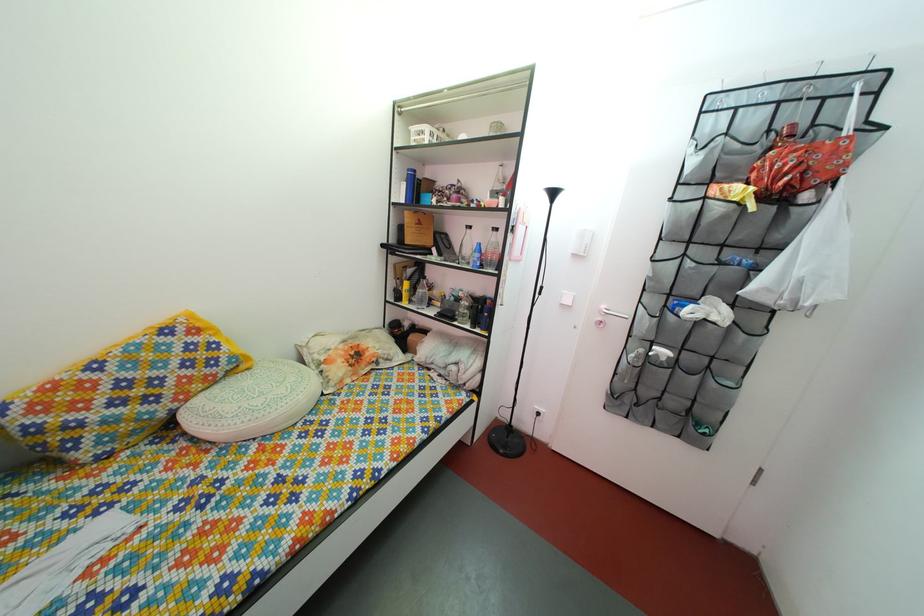
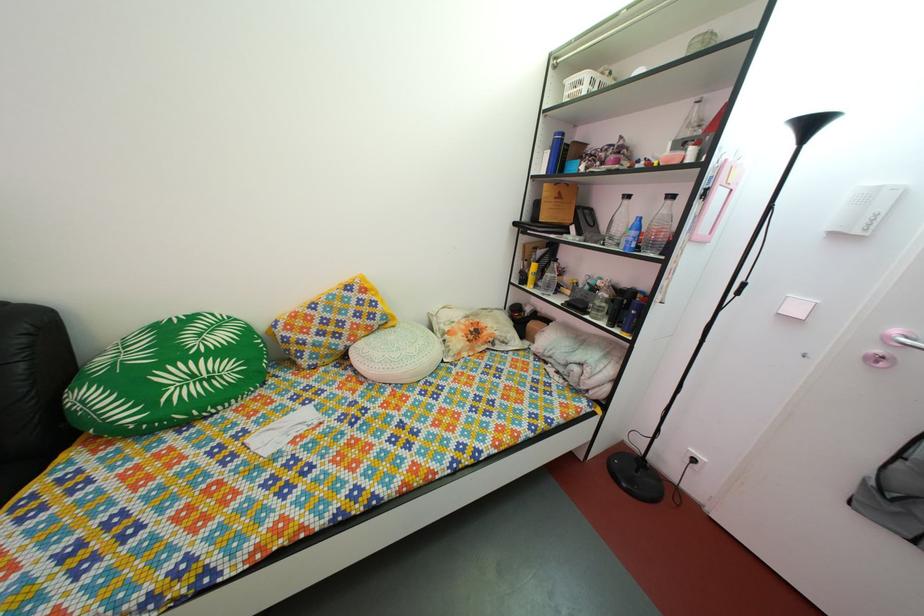
Question: The images are taken continuously from a first-person perspective. In which direction is your viewpoint rotating?

Choices:
 (A) Left
 (B) Right
 (C) Up
 (D) Down

Answer: (A)